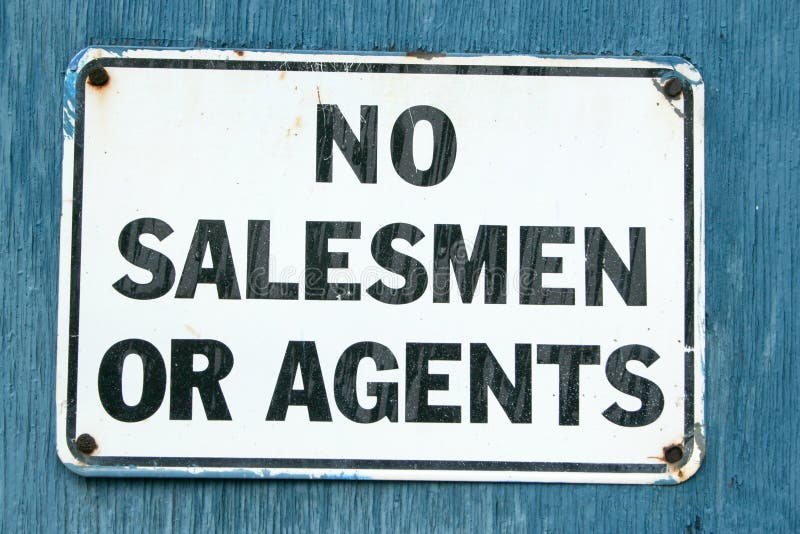
Find the location of `blue wall`. blue wall is located at coordinates (740, 325), (38, 339), (396, 20), (378, 508).